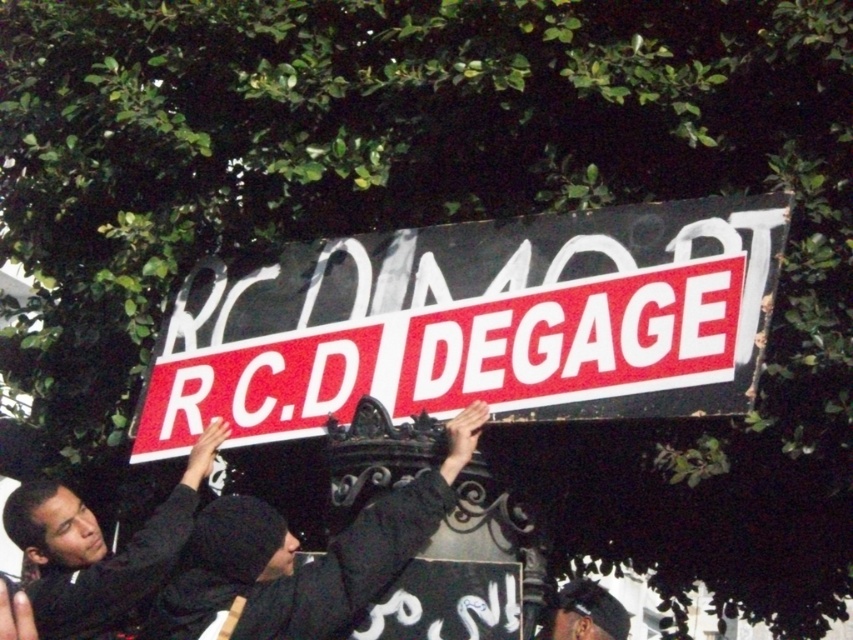
You are a photographer trying to capture the protest scene. You notice two points in the image at coordinates point (158, 611) and point (111, 561). Which point is closer to the camera?

Point (158, 611) is in front of point (111, 561), so it is closer to the camera.

You are a photographer standing at the camera position. You want to take a closeup photo of the black matte shirt at center. Can you estimate how far you need to move forward to get a clear closeup shot?

The black matte shirt at center is 163.48 feet away from the camera. To capture a closeup, you would need to move forward approximately 163.48 feet to reduce the distance, ensuring the subject fills the frame appropriately.